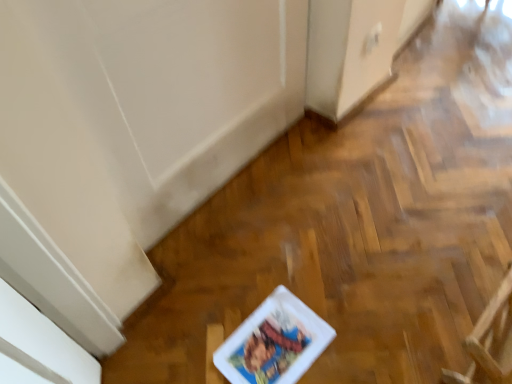
This screenshot has width=512, height=384. What do you see at coordinates (274, 342) in the screenshot?
I see `white glossy comic book at center` at bounding box center [274, 342].

Measure the distance between point (x=268, y=352) and camera.

A distance of 3.88 feet exists between point (x=268, y=352) and camera.

This screenshot has height=384, width=512. I want to click on white glossy comic book at center, so click(x=274, y=342).

Measure the distance between white glossy comic book at center and camera.

1.13 meters.

Locate an element on the screen. wooden armchair at lower right is located at coordinates (489, 342).

The image size is (512, 384). Describe the element at coordinates (489, 342) in the screenshot. I see `wooden armchair at lower right` at that location.

Identify the location of white glossy comic book at center. (274, 342).

Considering the positions of objects white glossy comic book at center and wooden armchair at lower right in the image provided, who is more to the right, white glossy comic book at center or wooden armchair at lower right?

Positioned to the right is wooden armchair at lower right.

Which object is further away from the camera, white glossy comic book at center or wooden armchair at lower right?

white glossy comic book at center is further away from the camera.

Which is nearer, (274, 343) or (479, 341)?

Point (274, 343) is farther from the camera than point (479, 341).

From the image's perspective, which is above, white glossy comic book at center or wooden armchair at lower right?

wooden armchair at lower right.

From a real-world perspective, relative to wooden armchair at lower right, is white glossy comic book at center vertically above or below?

white glossy comic book at center is situated lower than wooden armchair at lower right in the real world.

Which of these two, white glossy comic book at center or wooden armchair at lower right, is thinner?

With smaller width is wooden armchair at lower right.

Can you confirm if white glossy comic book at center is shorter than wooden armchair at lower right?

Yes.

Is white glossy comic book at center smaller than wooden armchair at lower right?

Correct, white glossy comic book at center occupies less space than wooden armchair at lower right.

Is white glossy comic book at center not within wooden armchair at lower right?

Yes, white glossy comic book at center is not within wooden armchair at lower right.

Is white glossy comic book at center next to wooden armchair at lower right and touching it?

white glossy comic book at center and wooden armchair at lower right are clearly separated.

Is white glossy comic book at center oriented away from wooden armchair at lower right?

white glossy comic book at center is not turned away from wooden armchair at lower right.

Based on the photo, what's the angular difference between white glossy comic book at center and wooden armchair at lower right's facing directions?

The facing directions of white glossy comic book at center and wooden armchair at lower right are 88.4 degrees apart.

Measure the distance from white glossy comic book at center to wooden armchair at lower right.

white glossy comic book at center and wooden armchair at lower right are 16.94 inches apart.

Identify the location of armchair that is above the white glossy comic book at center (from the image's perspective). This screenshot has height=384, width=512. (489, 342).

Considering the relative positions of wooden armchair at lower right and white glossy comic book at center in the image provided, is wooden armchair at lower right to the left of white glossy comic book at center from the viewer's perspective?

No, wooden armchair at lower right is not to the left of white glossy comic book at center.

Which is in front, wooden armchair at lower right or white glossy comic book at center?

wooden armchair at lower right.

Does point (470, 355) come in front of point (279, 342)?

Yes, it is.

From the image's perspective, which one is positioned higher, wooden armchair at lower right or white glossy comic book at center?

wooden armchair at lower right, from the image's perspective.

From a real-world perspective, which object rests below the other?

In real-world perspective, white glossy comic book at center is lower.

Considering the sizes of objects wooden armchair at lower right and white glossy comic book at center in the image provided, who is thinner, wooden armchair at lower right or white glossy comic book at center?

With smaller width is wooden armchair at lower right.

Is wooden armchair at lower right taller or shorter than white glossy comic book at center?

wooden armchair at lower right is taller than white glossy comic book at center.

Between wooden armchair at lower right and white glossy comic book at center, which one has smaller size?

Smaller between the two is white glossy comic book at center.

Does wooden armchair at lower right contain white glossy comic book at center?

No, white glossy comic book at center is not a part of wooden armchair at lower right.

Is wooden armchair at lower right next to white glossy comic book at center?

No, wooden armchair at lower right is not beside white glossy comic book at center.

Is wooden armchair at lower right turned away from white glossy comic book at center?

wooden armchair at lower right does not have its back to white glossy comic book at center.

How many degrees apart are the facing directions of wooden armchair at lower right and white glossy comic book at center?

There is a 88.4-degree angle between the facing directions of wooden armchair at lower right and white glossy comic book at center.

This screenshot has height=384, width=512. Identify the location of comic book lying behind the wooden armchair at lower right. (274, 342).

Find the location of a particular element. This screenshot has height=384, width=512. armchair in front of the white glossy comic book at center is located at coordinates (489, 342).

At what (x,y) coordinates should I click in order to perform the action: click on comic book that appears on the left of wooden armchair at lower right. Please return your answer as a coordinate pair (x, y). This screenshot has height=384, width=512. Looking at the image, I should click on tap(274, 342).